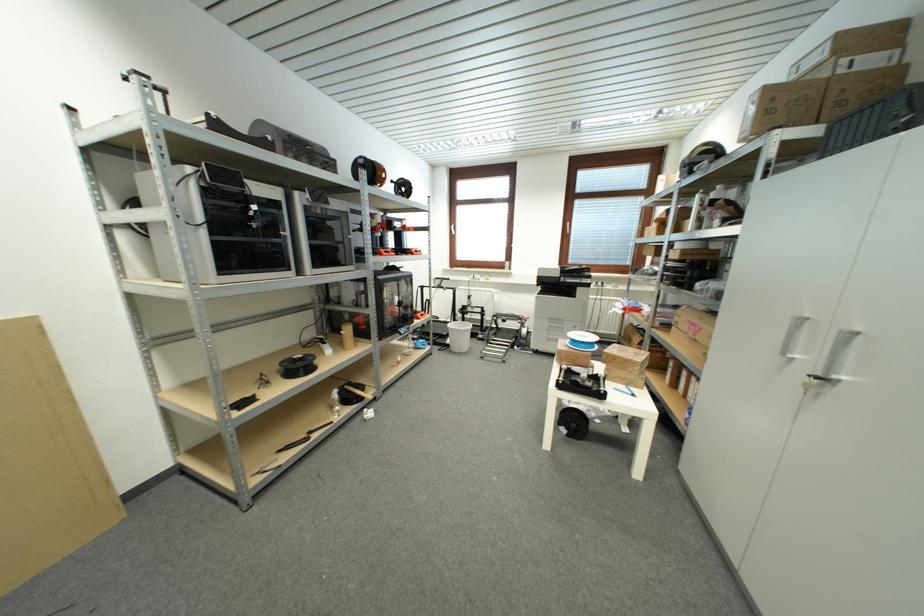
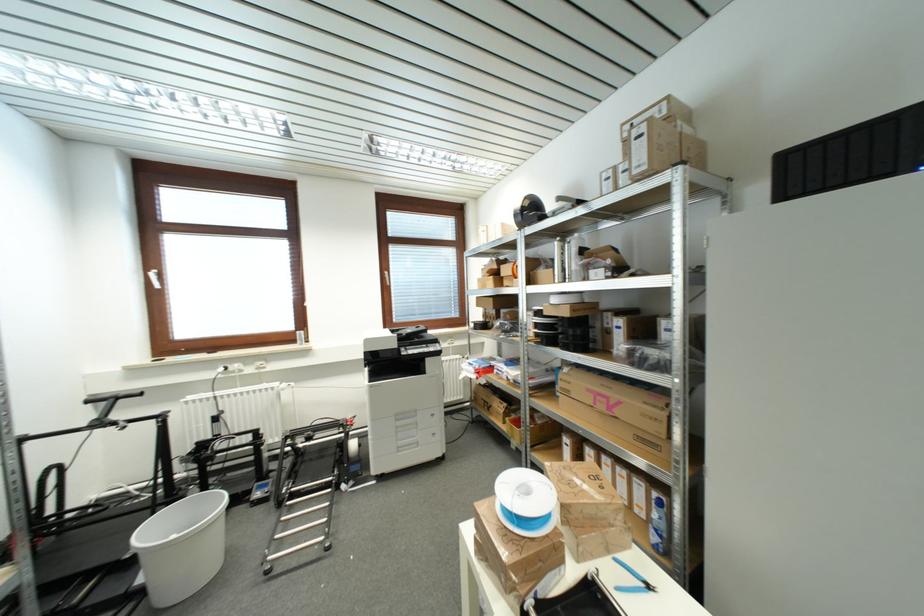
The point at (456, 228) is marked in the first image. Where is the corresponding point in the second image?

(151, 273)